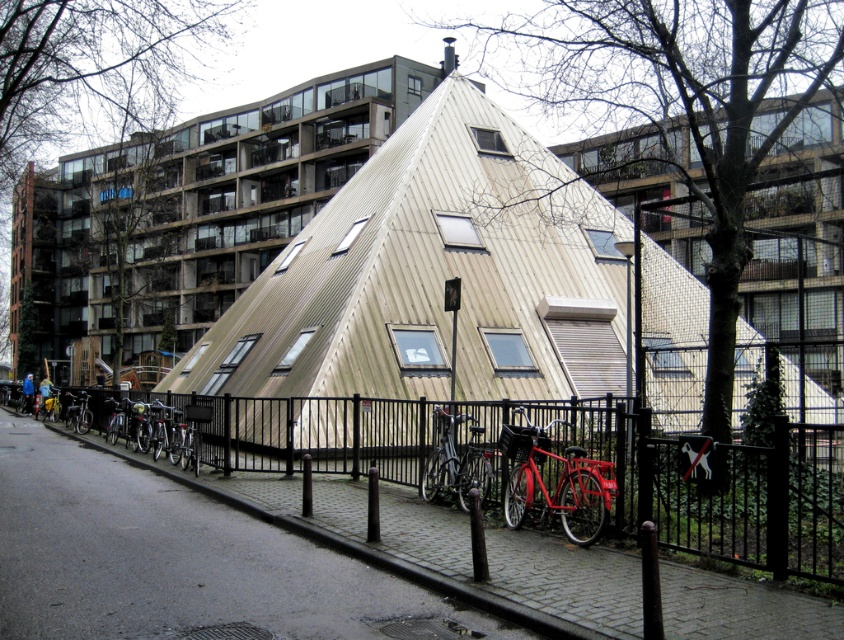
Question: From the image, what is the correct spatial relationship of shiny red bicycle at center in relation to shiny metallic bicycle at center?

Choices:
 (A) below
 (B) above

Answer: (A)

Question: Which object is farther from the camera taking this photo?

Choices:
 (A) shiny metallic bicycle at center
 (B) black metal fence at center
 (C) shiny red bicycle at center

Answer: (A)

Question: Considering the real-world distances, which object is closest to the shiny red bicycle at center?

Choices:
 (A) black metal fence at center
 (B) shiny metallic bicycle at center
 (C) black matte bicycle at lower left

Answer: (B)

Question: Can you confirm if shiny red bicycle at center is thinner than shiny metallic bicycle at center?

Choices:
 (A) yes
 (B) no

Answer: (B)

Question: Does shiny red bicycle at center have a greater width compared to black matte bicycle at lower left?

Choices:
 (A) yes
 (B) no

Answer: (B)

Question: Which object is the closest to the black matte bicycle at lower left?

Choices:
 (A) black metal fence at center
 (B) shiny red bicycle at center

Answer: (A)